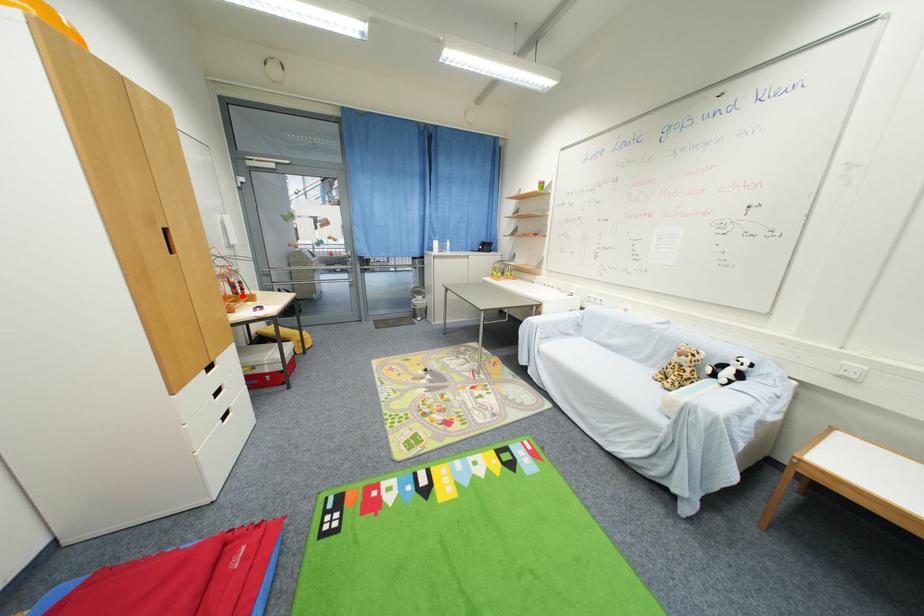
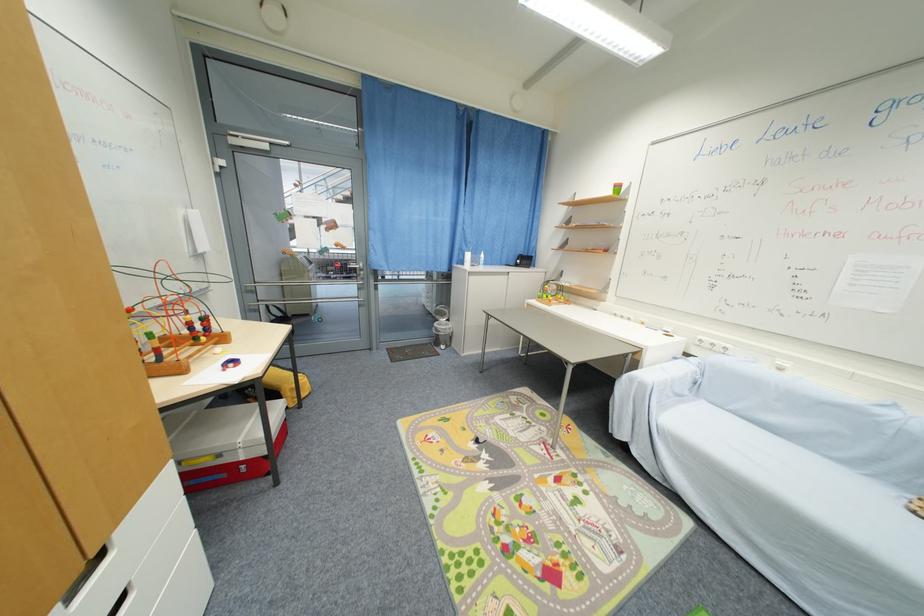
The point at the highlighted location is marked in the first image. Where is the corresponding point in the second image?

(201, 341)